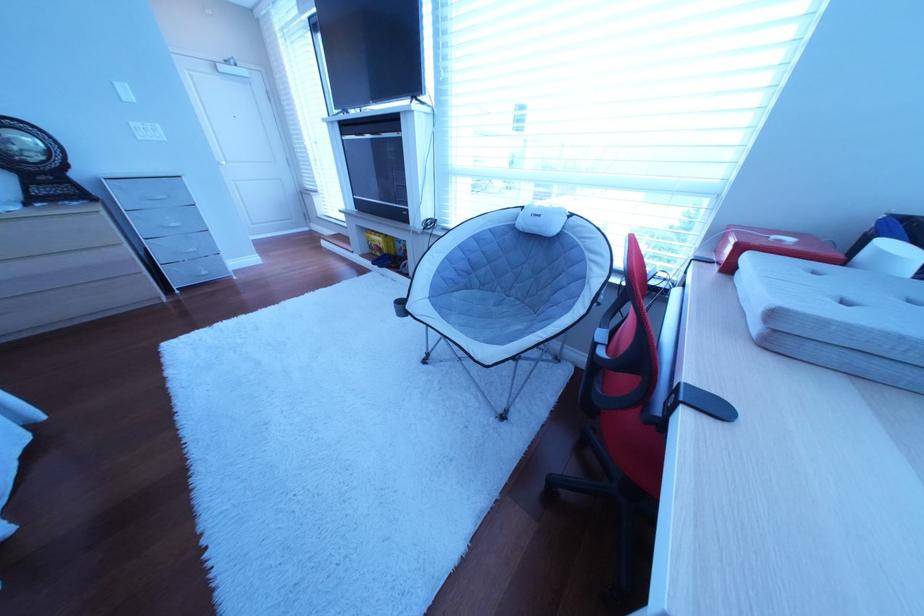
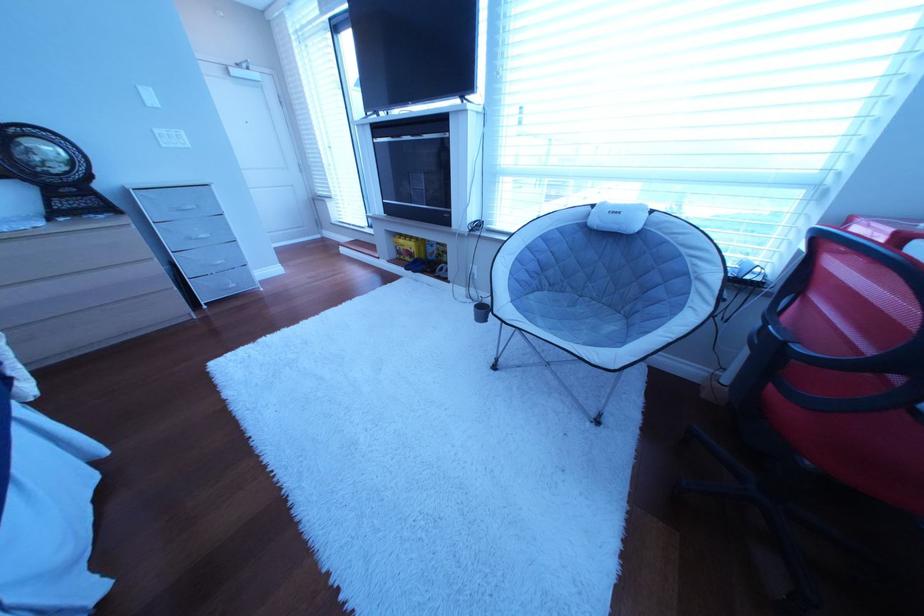
Find the pixel in the second image that matches point 155,140 in the first image.

(179, 148)